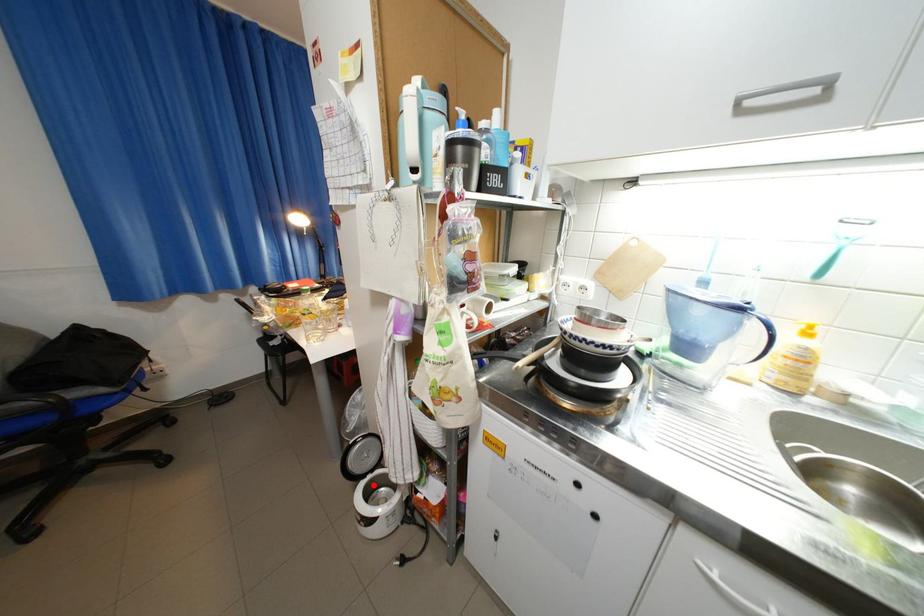
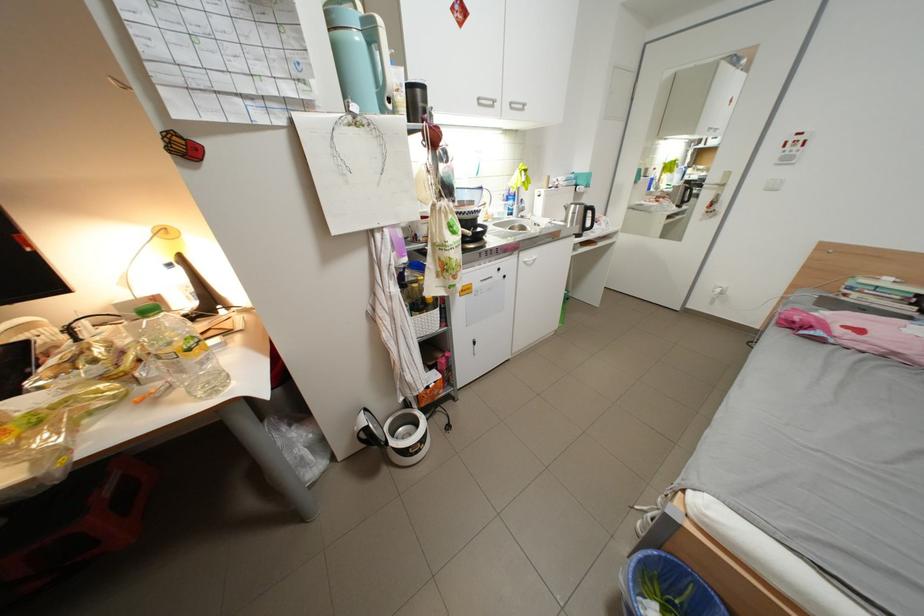
Question: I am providing you with two images of the same scene from different viewpoints. In image1, a red point is highlighted. Considering the same 3D point in image2, which of the following is correct?

Choices:
 (A) It is closer
 (B) It is farther

Answer: (A)